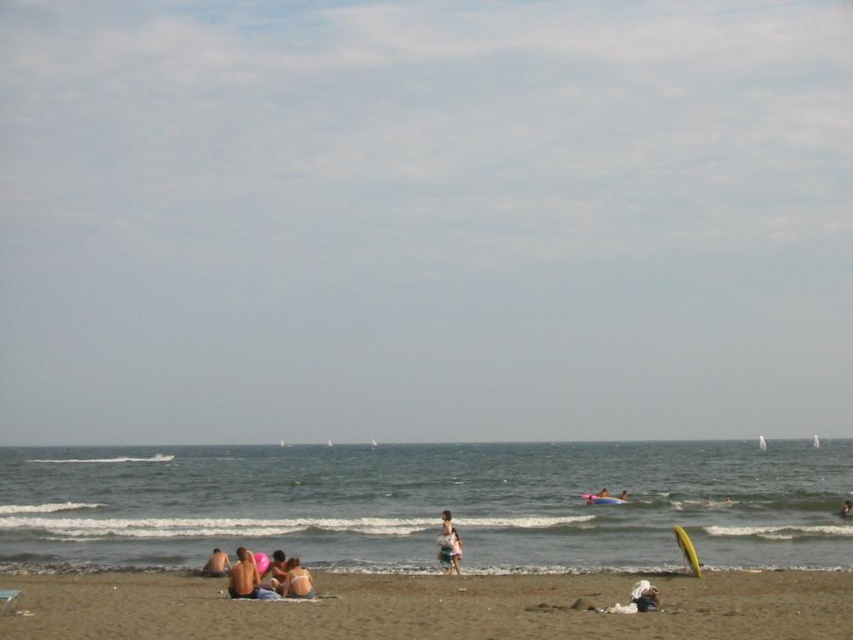
Is brown sandy beach at lower center thinner than light pink fabric dress at center?

No.

Consider the image. Between brown sandy beach at lower center and light pink fabric dress at center, which one is positioned higher?

Positioned higher is brown sandy beach at lower center.

Image resolution: width=853 pixels, height=640 pixels. Find the location of `brown sandy beach at lower center`. brown sandy beach at lower center is located at coordinates (432, 608).

Does transparent blue sky at upper center have a larger size compared to brown sandy beach at lower center?

Indeed, transparent blue sky at upper center has a larger size compared to brown sandy beach at lower center.

Is point (387, 26) behind point (770, 592)?

Yes, it is behind point (770, 592).

At what (x,y) coordinates should I click in order to perform the action: click on transparent blue sky at upper center. Please return your answer as a coordinate pair (x, y). The height and width of the screenshot is (640, 853). Looking at the image, I should click on (424, 220).

Looking at this image, does matte pink beach ball at lower center have a smaller size compared to beige sand at lower left?

Incorrect, matte pink beach ball at lower center is not smaller in size than beige sand at lower left.

Does matte pink beach ball at lower center have a greater width compared to beige sand at lower left?

Yes.

Describe the element at coordinates (247, 579) in the screenshot. I see `matte pink beach ball at lower center` at that location.

You are a GUI agent. You are given a task and a screenshot of the screen. Output one action in this format:
    pyautogui.click(x=<x>, y=<y>)
    Task: Click on the matte pink beach ball at lower center
    
    Given the screenshot: What is the action you would take?
    pyautogui.click(x=247, y=579)